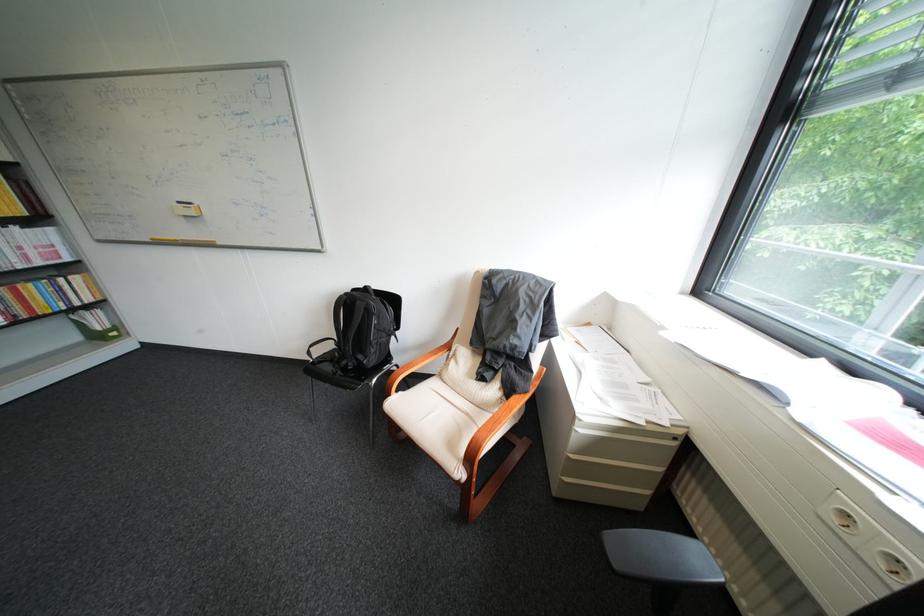
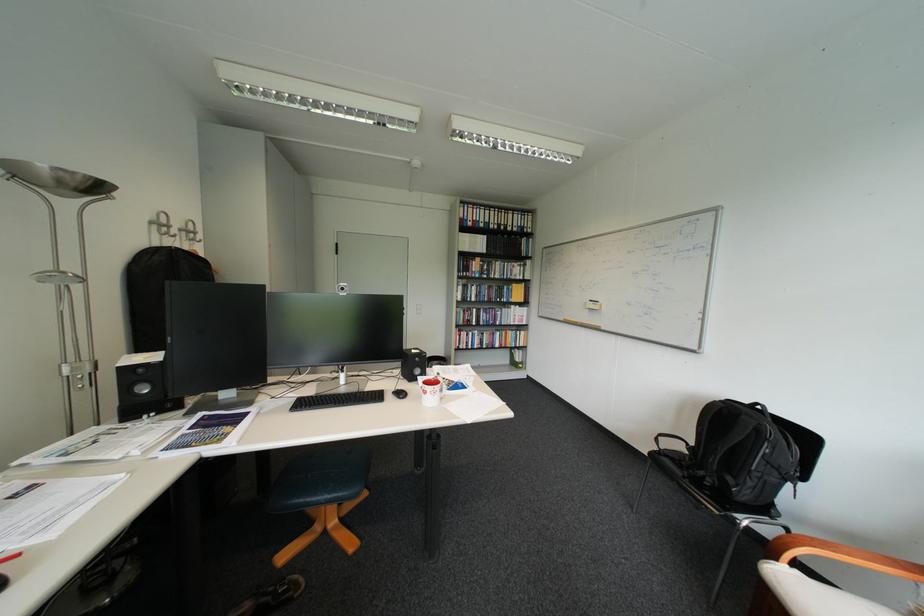
Question: I am providing you with two images of the same scene from different viewpoints. After the viewpoint changes to image2, which objects are now occluded?

Choices:
 (A) black webcam
 (B) black computer mouse
 (C) silver wall hook
 (D) none of these

Answer: (D)